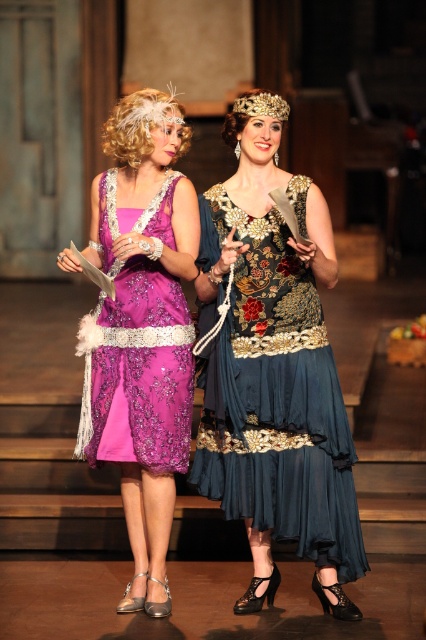
You are a stagehand standing 3 meters away from the camera. You need to adjust the spotlight so it reaches the matte purple dress at center. The spotlight has a minimum range of 2 meters and a maximum range of 6 meters. Can you position the spotlight correctly?

The distance between the matte purple dress at center and the camera is 5.24 meters. Since the spotlight has a maximum range of 6 meters and a minimum of 2 meters, positioning it at 5.24 meters would work as it falls within the acceptable range.

Looking at this image, you are a stagehand needing to place a 18 inch wide decorative panel between the velvet blue dress at center and the matte purple dress at center. Will the panel fit without overlapping either dress?

The distance between the velvet blue dress at center and the matte purple dress at center is 20.21 inches. Since the panel is 18 inches wide, it will fit between them without overlapping as there is enough space.

You are an audience member sitting in the front row of the theater. You notice two dresses at the center of the stage. Which dress is closer to you, the velvet blue dress at center or the purple satin dress at center?

The velvet blue dress at center is closer to you because it is in front of the purple satin dress at center.